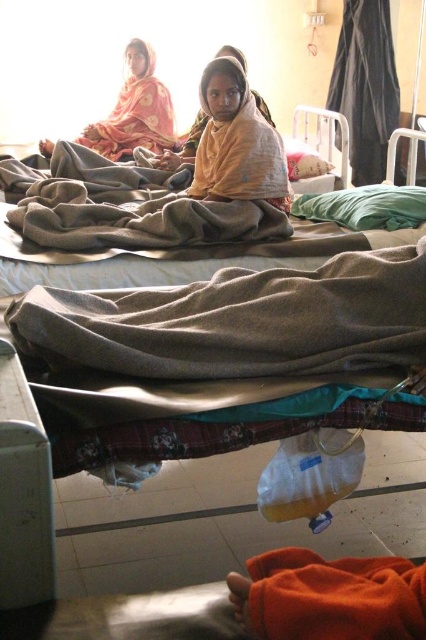
Question: Is beige woolen blanket at center to the left of gray woolen blanket at center from the viewer's perspective?

Choices:
 (A) no
 (B) yes

Answer: (A)

Question: Does gray woolen blanket at center lie in front of yellow fabric at center?

Choices:
 (A) no
 (B) yes

Answer: (B)

Question: Considering the real-world distances, which object is closest to the matte orange shawl at upper left?

Choices:
 (A) yellow fabric at center
 (B) beige woolen blanket at center
 (C) gray woolen blanket at center

Answer: (C)

Question: Is beige woolen blanket at center in front of gray woolen blanket at center?

Choices:
 (A) no
 (B) yes

Answer: (B)

Question: Estimate the real-world distances between objects in this image. Which object is farther from the matte orange shawl at upper left?

Choices:
 (A) gray woolen blanket at center
 (B) beige woolen blanket at center
 (C) yellow fabric at center

Answer: (B)

Question: Which point is closer to the camera?

Choices:
 (A) beige woolen blanket at center
 (B) gray woolen blanket at center

Answer: (A)